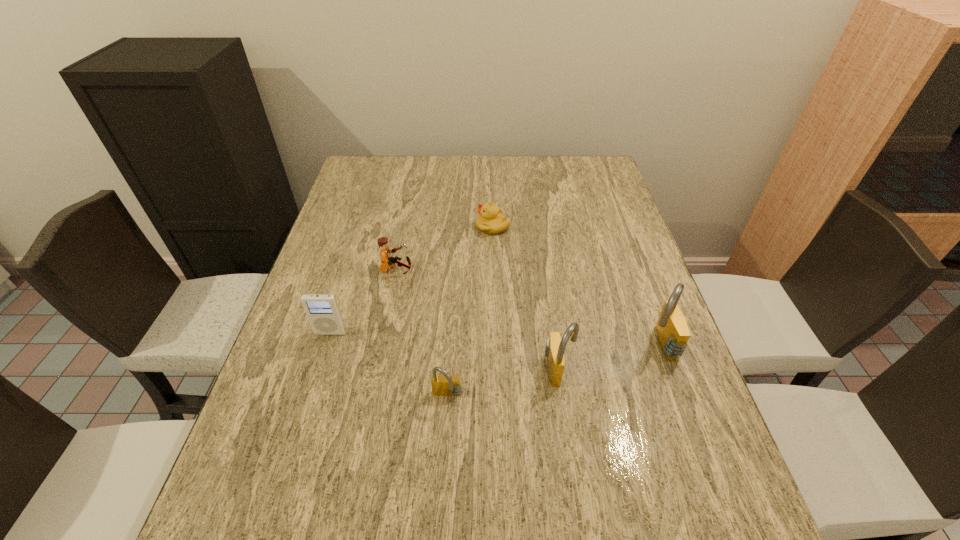
In order to click on the fourth object from right to left in this screenshot , I will do `click(442, 385)`.

I want to click on the nearest padlock, so click(x=442, y=385).

Where is `the second padlock from right to left`? Image resolution: width=960 pixels, height=540 pixels. the second padlock from right to left is located at coordinates coord(555,346).

Identify the location of the fifth object from left to right. (555, 346).

The image size is (960, 540). Find the location of `the rightmost object`. the rightmost object is located at coordinates (673, 334).

Locate an element on the screen. The height and width of the screenshot is (540, 960). the shortest object is located at coordinates (490, 221).

I want to click on duckling, so click(x=490, y=221).

At what (x,y) coordinates should I click in order to perform the action: click on the fourth shortest object. Please return your answer as a coordinate pair (x, y). Looking at the image, I should click on (322, 310).

I want to click on iPod, so click(x=322, y=310).

I want to click on the second object from left to right, so click(x=385, y=251).